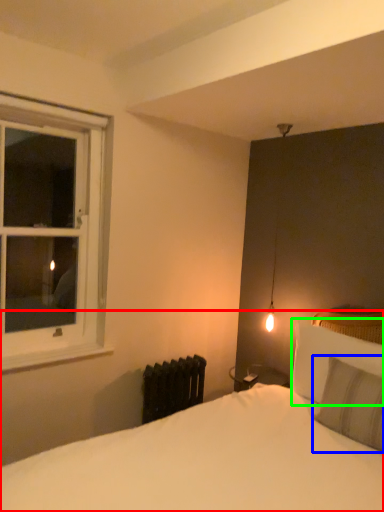
Question: Considering the real-world distances, which object is closest to bed (highlighted by a red box)? pillow (highlighted by a blue box) or pillow (highlighted by a green box).

Choices:
 (A) pillow
 (B) pillow

Answer: (A)